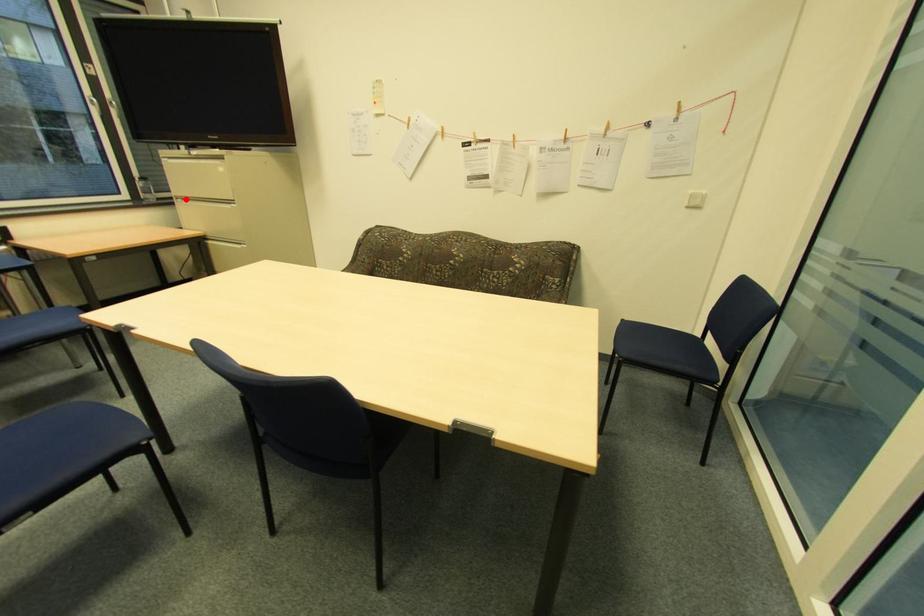
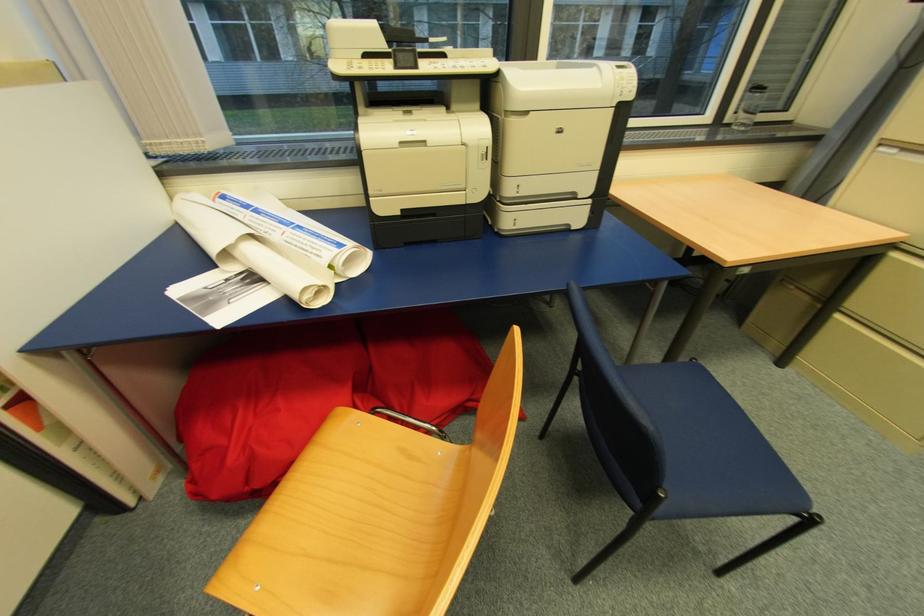
Find the pixel in the second image that matches the highlighted location in the first image.

(902, 150)